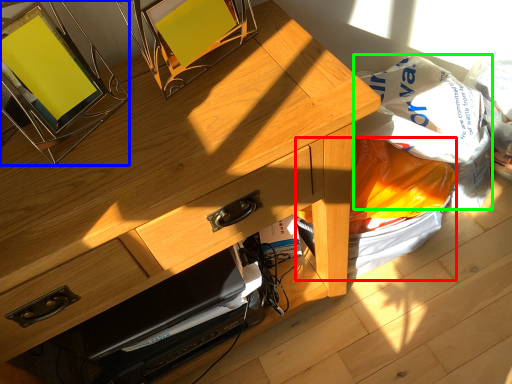
Question: Which object is positioned farthest from garbage (highlighted by a red box)? Select from picture frame (highlighted by a blue box) and grocery bag (highlighted by a green box).

Choices:
 (A) picture frame
 (B) grocery bag

Answer: (A)